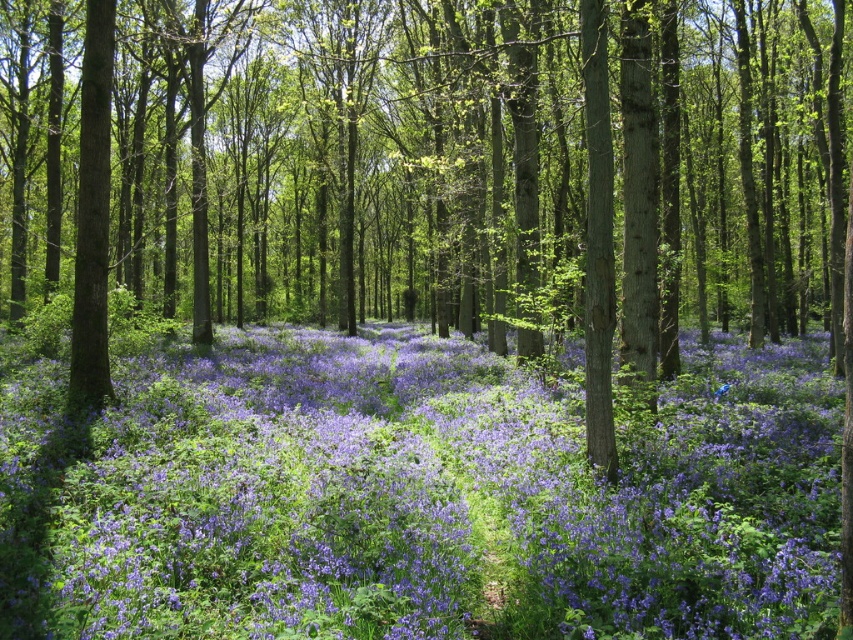
Does green rough bark tree at center have a greater height compared to purple matte flowers at center?

Yes.

Who is more forward, (x=38, y=112) or (x=560, y=460)?

Point (x=560, y=460) is more forward.

You are a GUI agent. You are given a task and a screenshot of the screen. Output one action in this format:
    pyautogui.click(x=<x>, y=<y>)
    Task: Click on the green rough bark tree at center
    The image size is (853, 640).
    Given the screenshot: What is the action you would take?
    pyautogui.click(x=436, y=168)